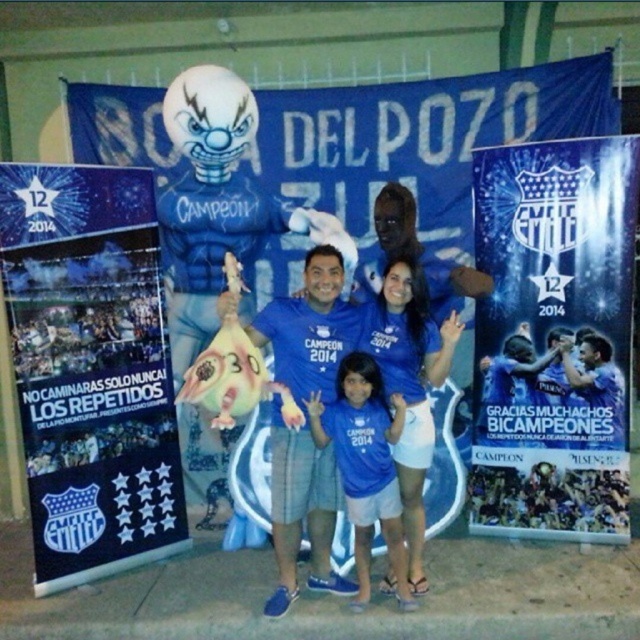
Between blue jersey at center and blue matte shirt at center, which one is positioned lower?

blue matte shirt at center is lower down.

Can you confirm if blue jersey at center is smaller than blue matte shirt at center?

No.

This screenshot has width=640, height=640. What do you see at coordinates (301, 512) in the screenshot?
I see `blue jersey at center` at bounding box center [301, 512].

Where is `blue jersey at center`? This screenshot has height=640, width=640. blue jersey at center is located at coordinates (301, 512).

Does blue paper poster at left appear on the left side of blue glossy poster at upper center?

Indeed, blue paper poster at left is positioned on the left side of blue glossy poster at upper center.

Does blue paper poster at left appear under blue glossy poster at upper center?

Yes, blue paper poster at left is below blue glossy poster at upper center.

Who is more forward, (132, 291) or (627, 492)?

Point (132, 291) is in front.

You are a GUI agent. You are given a task and a screenshot of the screen. Output one action in this format:
    pyautogui.click(x=<x>, y=<y>)
    Task: Click on the blue paper poster at left
    The width and height of the screenshot is (640, 640).
    Given the screenshot: What is the action you would take?
    pyautogui.click(x=90, y=369)

Which is more to the left, blue paper poster at left or blue jersey at center?

blue paper poster at left is more to the left.

Is point (76, 262) in front of point (320, 500)?

No, (76, 262) is behind (320, 500).

Image resolution: width=640 pixels, height=640 pixels. I want to click on blue paper poster at left, so click(90, 369).